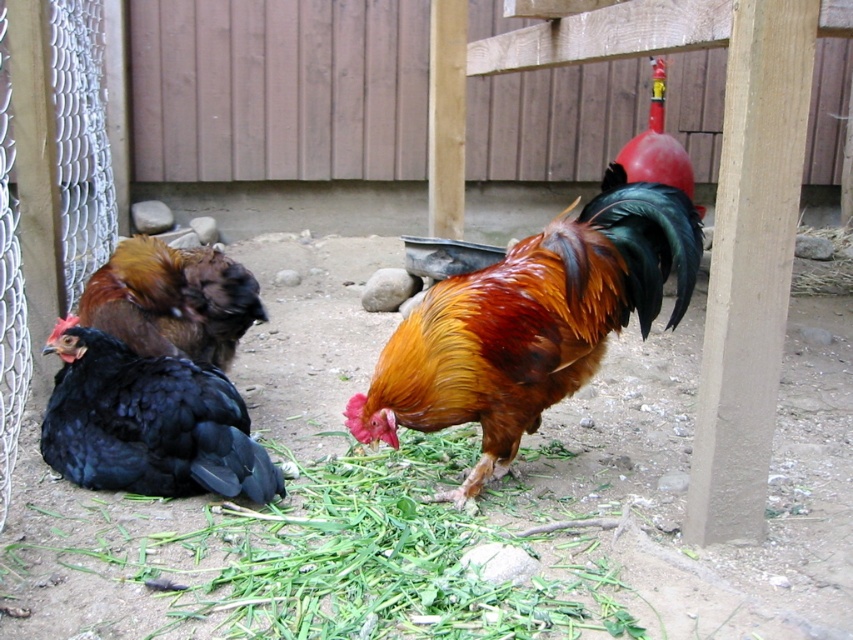
Which is more to the right, shiny brown rooster at center or black matte chicken at lower left?

shiny brown rooster at center

Does point (651, 236) come in front of point (257, 500)?

Yes.

Who is more distant from viewer, (506, 305) or (123, 356)?

Point (123, 356)

I want to click on shiny brown rooster at center, so click(531, 323).

Can you confirm if green leafy grass at center is wider than black matte chicken at lower left?

Indeed, green leafy grass at center has a greater width compared to black matte chicken at lower left.

Can you confirm if green leafy grass at center is positioned to the right of black matte chicken at lower left?

Yes, green leafy grass at center is to the right of black matte chicken at lower left.

This screenshot has width=853, height=640. What do you see at coordinates (296, 560) in the screenshot?
I see `green leafy grass at center` at bounding box center [296, 560].

Find the location of `green leafy grass at center`. green leafy grass at center is located at coordinates (296, 560).

Does black matte chicken at lower left appear under black glossy chicken at left?

Indeed, black matte chicken at lower left is positioned under black glossy chicken at left.

Which is below, black matte chicken at lower left or black glossy chicken at left?

black matte chicken at lower left is below.

The image size is (853, 640). What do you see at coordinates (148, 422) in the screenshot? I see `black matte chicken at lower left` at bounding box center [148, 422].

You are a GUI agent. You are given a task and a screenshot of the screen. Output one action in this format:
    pyautogui.click(x=<x>, y=<y>)
    Task: Click on the black matte chicken at lower left
    The width and height of the screenshot is (853, 640).
    Given the screenshot: What is the action you would take?
    pyautogui.click(x=148, y=422)